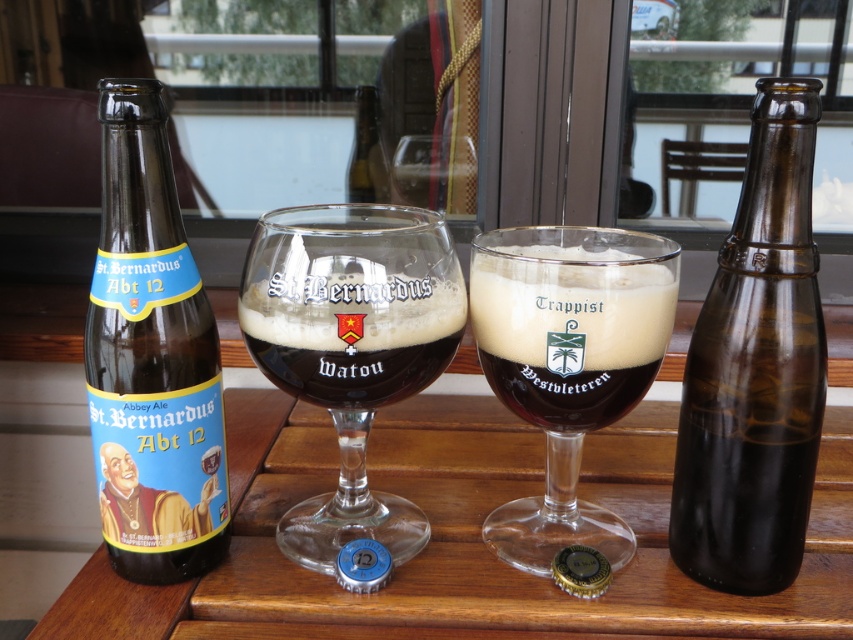
Question: Which point appears farthest from the camera in this image?

Choices:
 (A) (428, 320)
 (B) (364, 170)
 (C) (161, 294)

Answer: (B)

Question: Can you confirm if matte glass beer at center is positioned to the left of brown glass bottle at center?

Choices:
 (A) no
 (B) yes

Answer: (A)

Question: Estimate the real-world distances between objects in this image. Which object is closer to the brown glass bottle at right?

Choices:
 (A) clear glass beer glass at center
 (B) brown glass bottle at left

Answer: (A)

Question: Is brown glass bottle at right smaller than brown glass bottle at left?

Choices:
 (A) yes
 (B) no

Answer: (B)

Question: Where is brown glass bottle at right located in relation to brown glass bottle at left in the image?

Choices:
 (A) below
 (B) above

Answer: (A)

Question: Which object appears farthest from the camera in this image?

Choices:
 (A) clear glass beer glass at center
 (B) brown glass bottle at left
 (C) dark brown glass at center

Answer: (C)